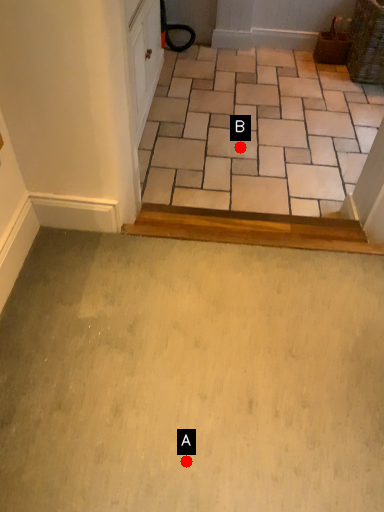
Question: Two points are circled on the image, labeled by A and B beside each circle. Which point is closer to the camera?

Choices:
 (A) A is closer
 (B) B is closer

Answer: (A)